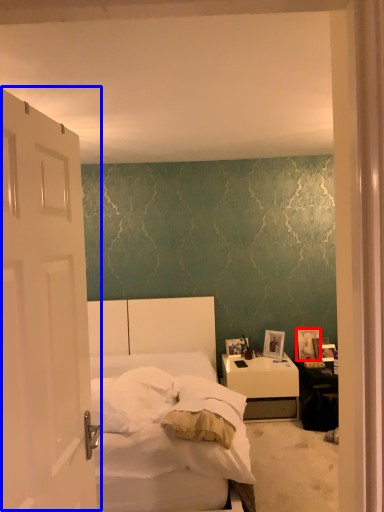
Question: Among these objects, which one is nearest to the camera, picture frame (highlighted by a red box) or door (highlighted by a blue box)?

Choices:
 (A) picture frame
 (B) door

Answer: (B)